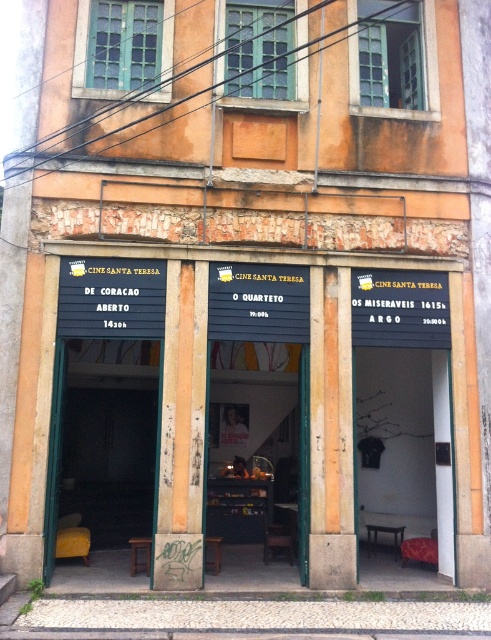
You are a visitor standing at the entrance of the cinema. You want to place a decorative wreath between the black painted wood signboard at center and the yellowish wood pillar at center. The wreath has a diameter of 30 centimeters. Will it fit without overlapping either object?

The distance between the black painted wood signboard at center and the yellowish wood pillar at center is 32.04 centimeters. Since the wreath has a diameter of 30 centimeters, it will fit between them without overlapping as 30 cm is less than 32.04 cm.

As a customer standing in front of the wooden counter at center and the yellowish wood pillar at center inside the cinema lobby, which object would you have to look up more to see the top of?

You would have to look up more to see the top of the yellowish wood pillar at center because it is taller than the wooden counter at center.

You are a cinema visitor who wants to sit comfortably while waiting for the movie. The cinema has a wooden chair at center and a wooden counter at center. Which object would you choose to sit on and why?

You should choose the wooden chair at center because it has a larger size compared to the wooden counter at center, making it more comfortable for sitting.